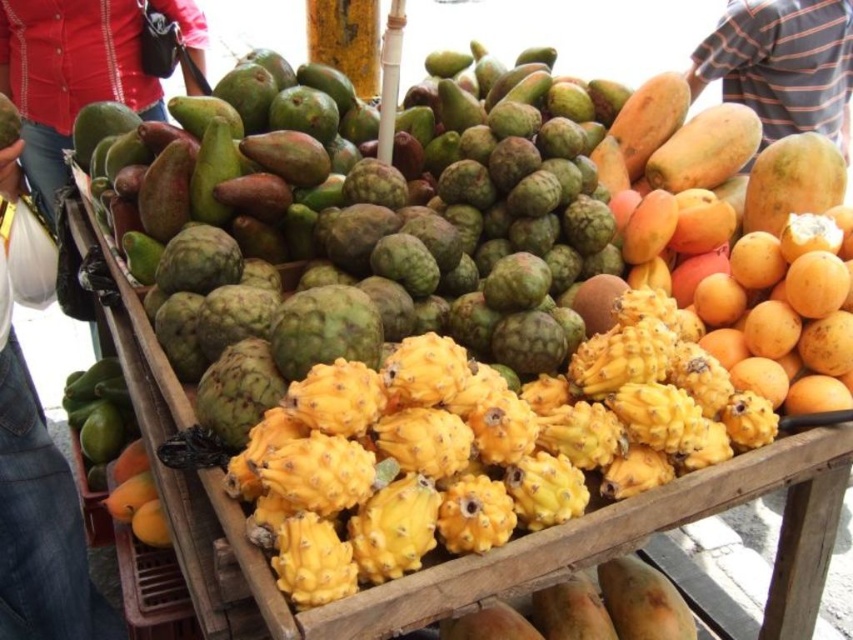
Consider the image. Is matte red shirt at upper left positioned behind striped cotton shirt at upper right?

No, matte red shirt at upper left is in front of striped cotton shirt at upper right.

Is point (28, 8) behind point (827, 108)?

No.

Locate an element on the screen. This screenshot has width=853, height=640. matte red shirt at upper left is located at coordinates (68, 76).